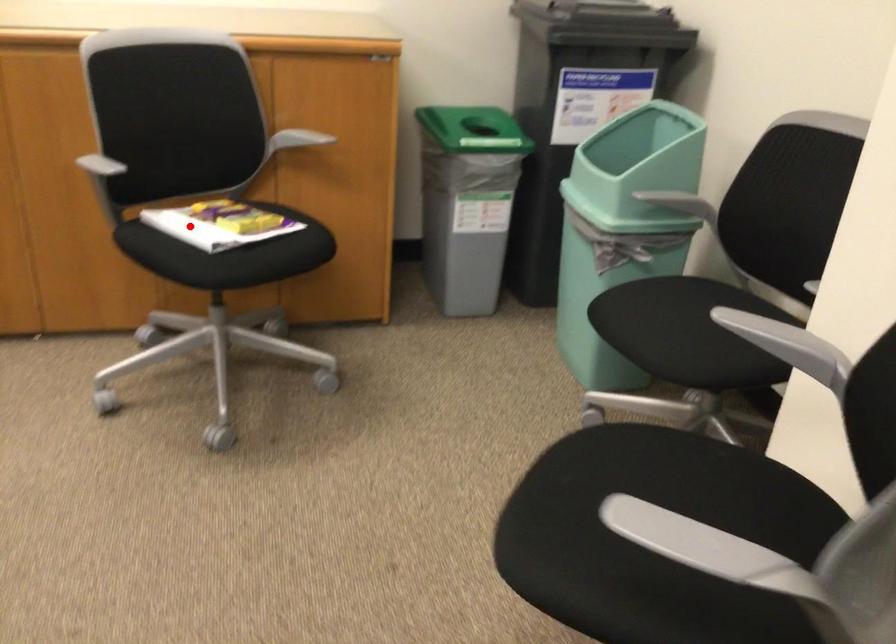
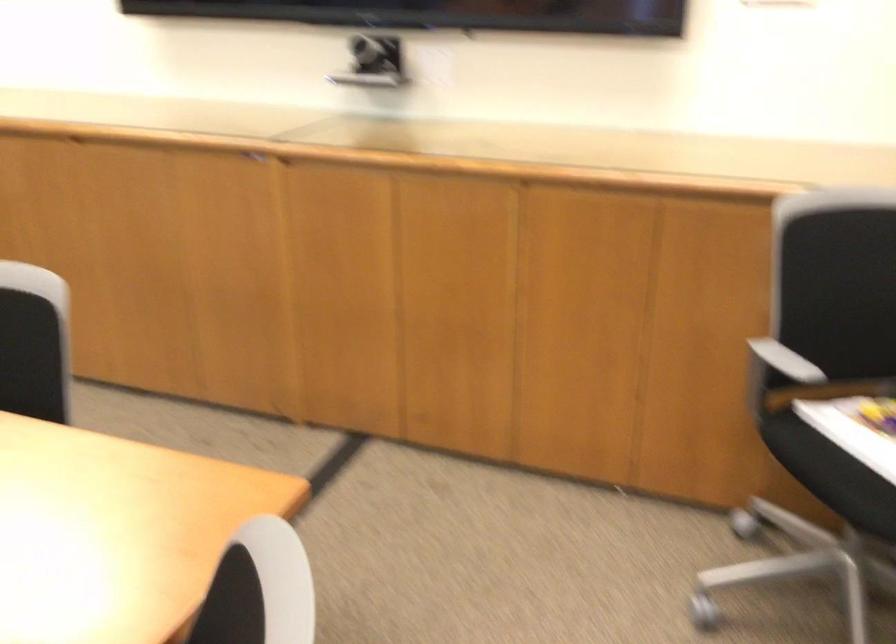
Question: A red point is marked in image1. In image2, is the corresponding 3D point closer to the camera or farther? Reply with the corresponding letter.

Choices:
 (A) The corresponding 3D point is closer.
 (B) The corresponding 3D point is farther.

Answer: (A)